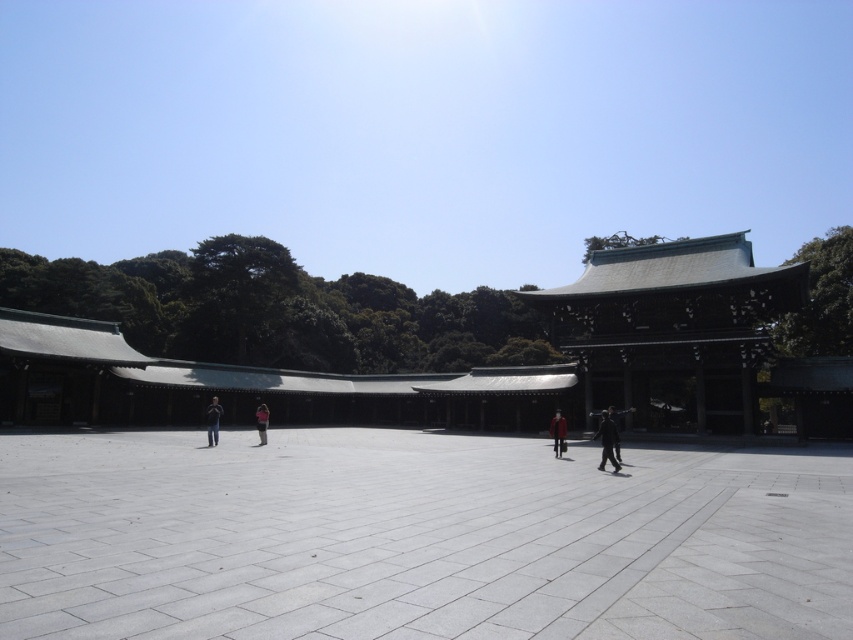
Question: Estimate the real-world distances between objects in this image. Which object is farther from the light brown leather jacket at center?

Choices:
 (A) pink fabric person at center
 (B) dark gray fabric jacket at center
 (C) red leather jacket at center
 (D) green wooden temple at center

Answer: (D)

Question: Is green wooden temple at center thinner than red leather jacket at center?

Choices:
 (A) yes
 (B) no

Answer: (B)

Question: Estimate the real-world distances between objects in this image. Which object is closer to the dark gray fabric jacket at center?

Choices:
 (A) pink fabric person at center
 (B) green wooden temple at center
 (C) gray concrete courtyard at center
 (D) red leather jacket at center

Answer: (D)

Question: Is red leather jacket at center bigger than pink fabric person at center?

Choices:
 (A) yes
 (B) no

Answer: (B)

Question: Which point is closer to the camera?

Choices:
 (A) green wooden temple at center
 (B) gray concrete courtyard at center
 (C) dark gray fabric jacket at center

Answer: (B)

Question: Observing the image, what is the correct spatial positioning of dark gray fabric jacket at center in reference to pink fabric person at center?

Choices:
 (A) right
 (B) left

Answer: (A)